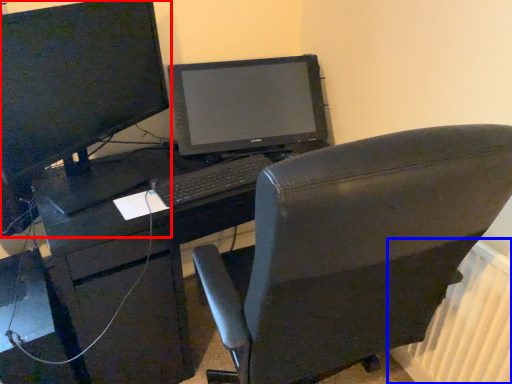
Question: Among these objects, which one is nearest to the camera, computer monitor (highlighted by a red box) or radiator (highlighted by a blue box)?

Choices:
 (A) computer monitor
 (B) radiator

Answer: (A)